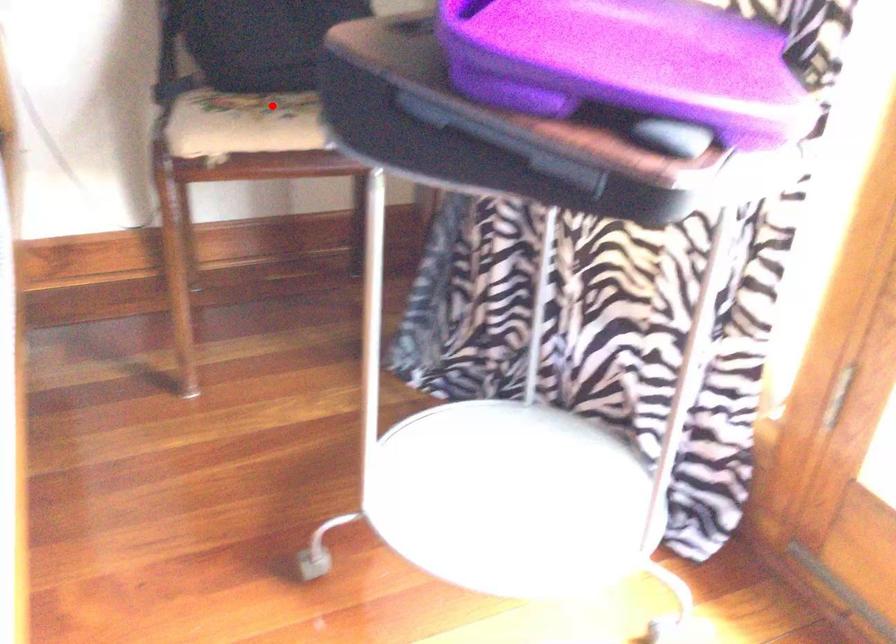
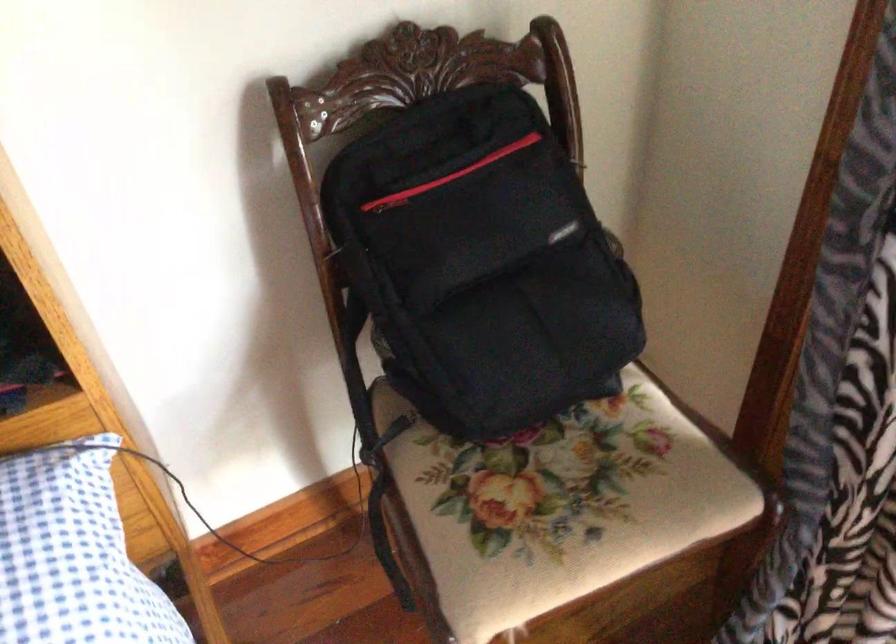
Where in the second image is the point corresponding to the highlighted location from the first image?

(556, 506)